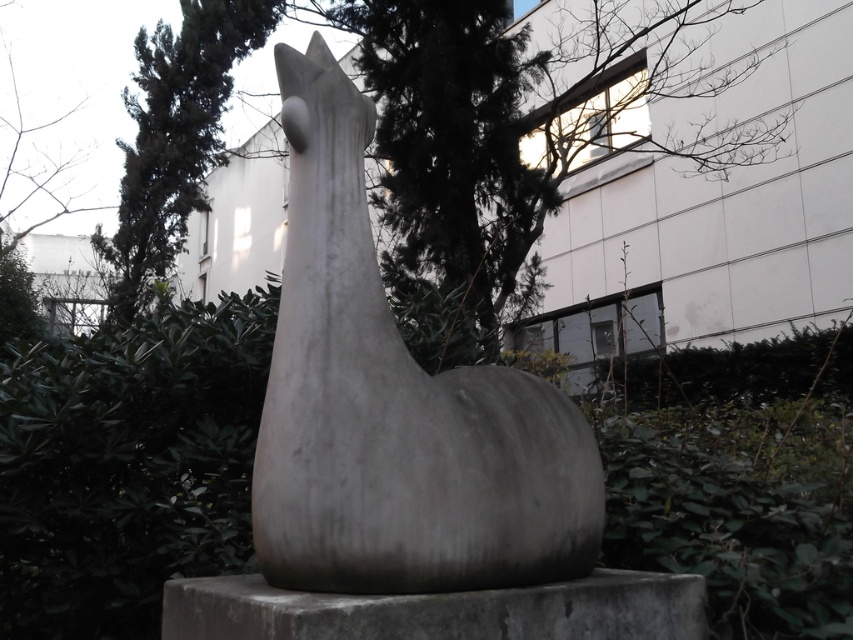
Does green leafy tree at center have a lesser width compared to green leafy tree at upper center?

No.

Can you confirm if green leafy tree at center is positioned to the left of green leafy tree at upper center?

Incorrect, green leafy tree at center is not on the left side of green leafy tree at upper center.

Is point (457, 52) behind point (213, 13)?

No, it is not.

Identify the location of green leafy tree at center. (515, 116).

Who is shorter, green leafy tree at center or gray concrete at center?

gray concrete at center is shorter.

Can you confirm if green leafy tree at center is thinner than gray concrete at center?

In fact, green leafy tree at center might be wider than gray concrete at center.

Is point (608, 131) positioned before point (450, 611)?

No, (608, 131) is behind (450, 611).

This screenshot has width=853, height=640. Find the location of `green leafy tree at center`. green leafy tree at center is located at coordinates (515, 116).

Is white stone sculpture at center bigger than green leafy tree at upper center?

No, white stone sculpture at center is not bigger than green leafy tree at upper center.

Can you confirm if white stone sculpture at center is wider than green leafy tree at upper center?

No, white stone sculpture at center is not wider than green leafy tree at upper center.

What do you see at coordinates (395, 406) in the screenshot? The width and height of the screenshot is (853, 640). I see `white stone sculpture at center` at bounding box center [395, 406].

At what (x,y) coordinates should I click in order to perform the action: click on white stone sculpture at center. Please return your answer as a coordinate pair (x, y). The height and width of the screenshot is (640, 853). Looking at the image, I should click on (395, 406).